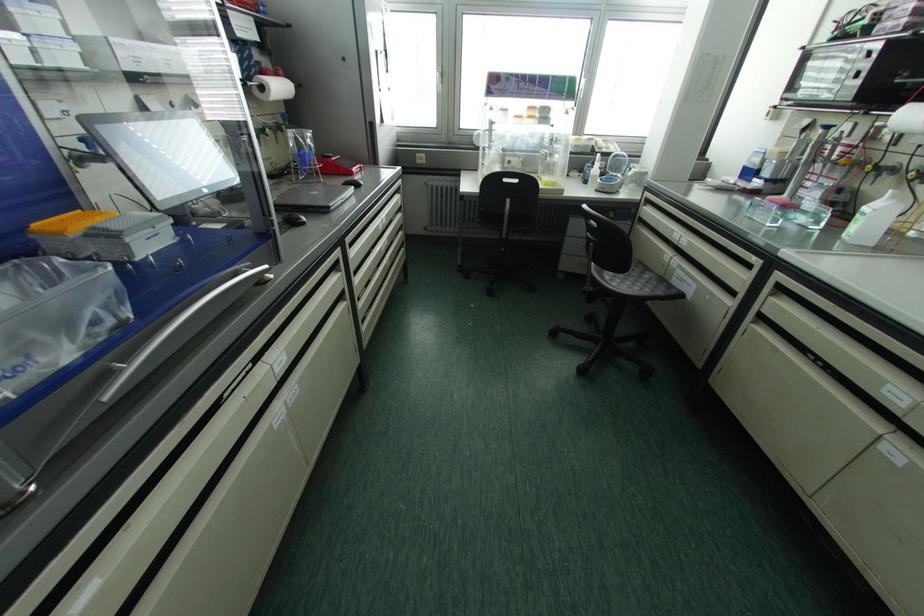
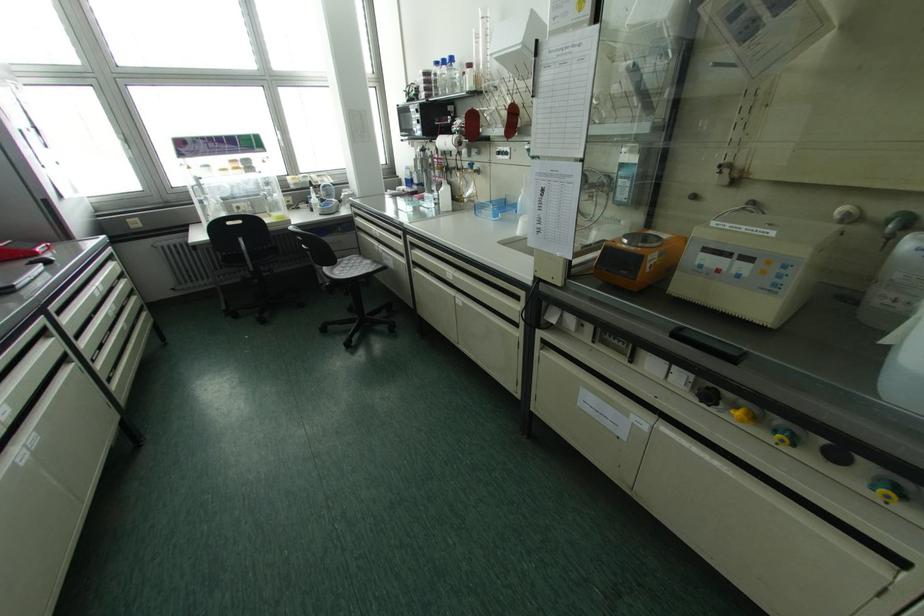
Find the pixel in the second image that matches [422,155] in the first image.

(137, 219)